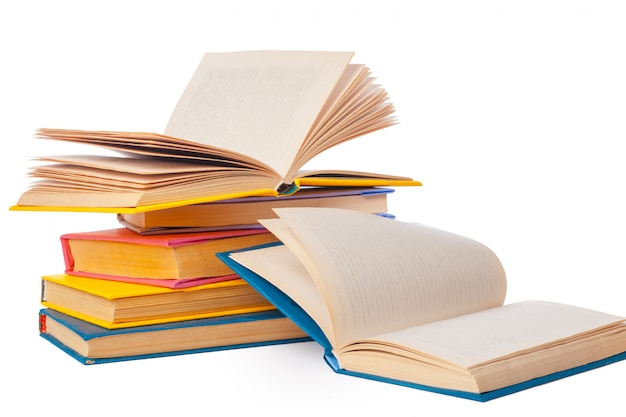
What are the coordinates of `books` in the screenshot? It's located at (275, 166), (250, 203), (207, 247), (178, 298), (173, 333).